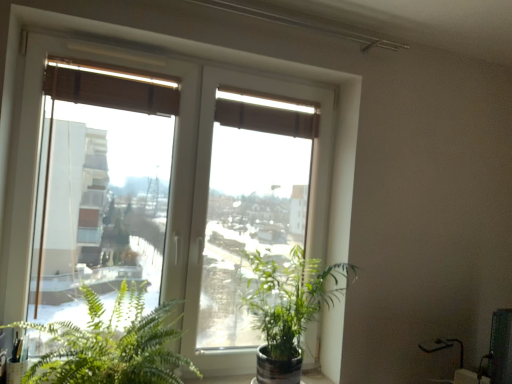
Measure the distance between point [306,106] and camera.

They are 2.13 meters apart.

Identify the location of transparent glass window at center. (162, 191).

The width and height of the screenshot is (512, 384). Find the location of `green glossy plant at center, marked as the 2th houseplant in a left-to-right arrangement`. green glossy plant at center, marked as the 2th houseplant in a left-to-right arrangement is located at coordinates (289, 309).

Is the depth of brown fabric curtain at upper center greater than that of green glossy plant at center, the 1th houseplant when ordered from right to left?

Yes, brown fabric curtain at upper center is further from the viewer.

Considering the sizes of objects brown fabric curtain at upper center and green glossy plant at center, the 1th houseplant when ordered from right to left, in the image provided, who is bigger, brown fabric curtain at upper center or green glossy plant at center, the 1th houseplant when ordered from right to left,?

Bigger between the two is green glossy plant at center, the 1th houseplant when ordered from right to left.

Is brown fabric curtain at upper center oriented towards green glossy plant at center, the 1th houseplant when ordered from right to left?

No, brown fabric curtain at upper center is not oriented towards green glossy plant at center, the 1th houseplant when ordered from right to left.

What's the angular difference between brown fabric curtain at upper center and green glossy plant at center, the 1th houseplant when ordered from right to left,'s facing directions?

0.455 degrees separate the facing orientations of brown fabric curtain at upper center and green glossy plant at center, the 1th houseplant when ordered from right to left.

From a real-world perspective, is green leafy plant at lower left, positioned as the first houseplant in left-to-right order, above or below brown fabric curtain at upper center?

green leafy plant at lower left, positioned as the first houseplant in left-to-right order, is below brown fabric curtain at upper center.

Is green leafy plant at lower left, the second houseplant viewed from the right, next to brown fabric curtain at upper center?

No, green leafy plant at lower left, the second houseplant viewed from the right, is not with brown fabric curtain at upper center.

Does green leafy plant at lower left, positioned as the first houseplant in left-to-right order, have a smaller size compared to brown fabric curtain at upper center?

Actually, green leafy plant at lower left, positioned as the first houseplant in left-to-right order, might be larger than brown fabric curtain at upper center.

From the image's perspective, is brown fabric curtain at upper center located above transparent glass window at center?

Indeed, from the image's perspective, brown fabric curtain at upper center is shown above transparent glass window at center.

How many degrees apart are the facing directions of brown fabric curtain at upper center and transparent glass window at center?

The facing directions of brown fabric curtain at upper center and transparent glass window at center are 0.000846 degrees apart.

Between brown fabric curtain at upper center and transparent glass window at center, which one has smaller size?

brown fabric curtain at upper center.

How many degrees apart are the facing directions of green leafy plant at lower left, positioned as the first houseplant in left-to-right order, and transparent glass window at center?

There is a 0.455-degree angle between the facing directions of green leafy plant at lower left, positioned as the first houseplant in left-to-right order, and transparent glass window at center.

What are the coordinates of `the 2nd houseplant positioned below the transparent glass window at center (from the image's perspective)` in the screenshot? It's located at (111, 344).

From a real-world perspective, which object stands above the other?

transparent glass window at center is physically above.

From the image's perspective, would you say green glossy plant at center, marked as the 2th houseplant in a left-to-right arrangement, is shown under green leafy plant at lower left, the second houseplant viewed from the right?

No.

In the scene shown: Which object is positioned more to the right, green glossy plant at center, the 1th houseplant when ordered from right to left, or green leafy plant at lower left, the second houseplant viewed from the right?

green glossy plant at center, the 1th houseplant when ordered from right to left, is more to the right.

Is green glossy plant at center, the 1th houseplant when ordered from right to left, facing towards green leafy plant at lower left, the second houseplant viewed from the right?

No, green glossy plant at center, the 1th houseplant when ordered from right to left, is not oriented towards green leafy plant at lower left, the second houseplant viewed from the right.

Would you say green glossy plant at center, the 1th houseplant when ordered from right to left, contains green leafy plant at lower left, the second houseplant viewed from the right?

No, green glossy plant at center, the 1th houseplant when ordered from right to left, does not contain green leafy plant at lower left, the second houseplant viewed from the right.

How different are the orientations of green glossy plant at center, the 1th houseplant when ordered from right to left, and transparent glass window at center in degrees?

0.455 degrees.

Is green glossy plant at center, the 1th houseplant when ordered from right to left, positioned in front of transparent glass window at center?

Yes.

Measure the distance from green glossy plant at center, the 1th houseplant when ordered from right to left, to transparent glass window at center.

green glossy plant at center, the 1th houseplant when ordered from right to left, and transparent glass window at center are 14.88 inches apart.

Is transparent glass window at center at the back of green glossy plant at center, the 1th houseplant when ordered from right to left?

Absolutely, green glossy plant at center, the 1th houseplant when ordered from right to left, is directed away from transparent glass window at center.

How much distance is there between green glossy plant at center, the 1th houseplant when ordered from right to left, and brown fabric curtain at upper center?

green glossy plant at center, the 1th houseplant when ordered from right to left, and brown fabric curtain at upper center are 29.43 inches apart from each other.

Is green glossy plant at center, the 1th houseplant when ordered from right to left, taller or shorter than brown fabric curtain at upper center?

Considering their sizes, green glossy plant at center, the 1th houseplant when ordered from right to left, has more height than brown fabric curtain at upper center.

Based on the photo, is green glossy plant at center, marked as the 2th houseplant in a left-to-right arrangement, further to the viewer compared to brown fabric curtain at upper center?

No, the depth of green glossy plant at center, marked as the 2th houseplant in a left-to-right arrangement, is less than that of brown fabric curtain at upper center.

From the image's perspective, does green glossy plant at center, marked as the 2th houseplant in a left-to-right arrangement, appear lower than brown fabric curtain at upper center?

Correct, green glossy plant at center, marked as the 2th houseplant in a left-to-right arrangement, appears lower than brown fabric curtain at upper center in the image.

From a real-world perspective, count 1st houseplants downward from the brown fabric curtain at upper center and point to it. Please provide its 2D coordinates.

[(289, 309)]

Identify the location of curtain located on the right of green leafy plant at lower left, the second houseplant viewed from the right. This screenshot has height=384, width=512. (266, 115).

Based on their spatial positions, is brown fabric curtain at upper center or green leafy plant at lower left, the second houseplant viewed from the right, closer to transparent glass window at center?

green leafy plant at lower left, the second houseplant viewed from the right.

Looking at this image, based on their spatial positions, is green glossy plant at center, marked as the 2th houseplant in a left-to-right arrangement, or transparent glass window at center closer to green leafy plant at lower left, positioned as the first houseplant in left-to-right order?

transparent glass window at center.

Looking at the image, which one is located further to green glossy plant at center, marked as the 2th houseplant in a left-to-right arrangement, transparent glass window at center or brown fabric curtain at upper center?

brown fabric curtain at upper center.

Based on their spatial positions, is green leafy plant at lower left, positioned as the first houseplant in left-to-right order, or transparent glass window at center closer to brown fabric curtain at upper center?

transparent glass window at center is positioned closer to the anchor brown fabric curtain at upper center.

From the image, which object appears to be farther from brown fabric curtain at upper center, transparent glass window at center or green glossy plant at center, marked as the 2th houseplant in a left-to-right arrangement?

green glossy plant at center, marked as the 2th houseplant in a left-to-right arrangement.

Consider the image. When comparing their distances from green glossy plant at center, marked as the 2th houseplant in a left-to-right arrangement, does brown fabric curtain at upper center or green leafy plant at lower left, positioned as the first houseplant in left-to-right order, seem closer?

green leafy plant at lower left, positioned as the first houseplant in left-to-right order, lies closer to green glossy plant at center, marked as the 2th houseplant in a left-to-right arrangement, than the other object.

From the image, which object appears to be farther from transparent glass window at center, green leafy plant at lower left, positioned as the first houseplant in left-to-right order, or brown fabric curtain at upper center?

The object further to transparent glass window at center is brown fabric curtain at upper center.

Which object lies nearer to the anchor point transparent glass window at center, green glossy plant at center, marked as the 2th houseplant in a left-to-right arrangement, or brown fabric curtain at upper center?

green glossy plant at center, marked as the 2th houseplant in a left-to-right arrangement, lies closer to transparent glass window at center than the other object.

Identify the location of houseplant between brown fabric curtain at upper center and green leafy plant at lower left, the second houseplant viewed from the right, vertically. Image resolution: width=512 pixels, height=384 pixels. (289, 309).

This screenshot has width=512, height=384. Find the location of `window between green leafy plant at lower left, the second houseplant viewed from the right, and green glossy plant at center, the 1th houseplant when ordered from right to left, in the horizontal direction`. window between green leafy plant at lower left, the second houseplant viewed from the right, and green glossy plant at center, the 1th houseplant when ordered from right to left, in the horizontal direction is located at coordinates (162, 191).

Where is `window between brown fabric curtain at upper center and green glossy plant at center, marked as the 2th houseplant in a left-to-right arrangement, vertically`? The width and height of the screenshot is (512, 384). window between brown fabric curtain at upper center and green glossy plant at center, marked as the 2th houseplant in a left-to-right arrangement, vertically is located at coordinates (162, 191).

You are a GUI agent. You are given a task and a screenshot of the screen. Output one action in this format:
    pyautogui.click(x=<x>, y=<y>)
    Task: Click on the window between brown fabric curtain at upper center and green leafy plant at lower left, positioned as the first houseplant in left-to-right order, vertically
    This screenshot has width=512, height=384.
    Given the screenshot: What is the action you would take?
    pyautogui.click(x=162, y=191)